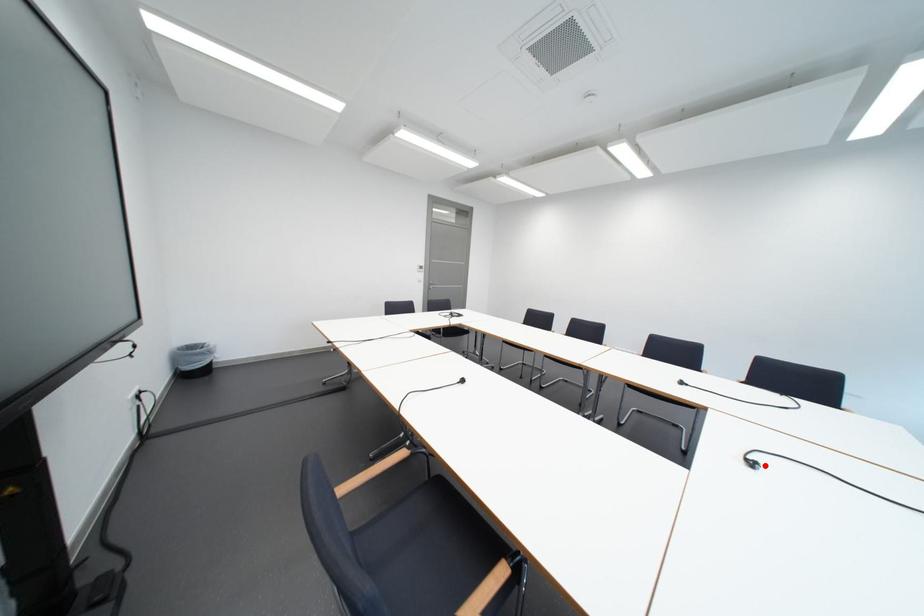
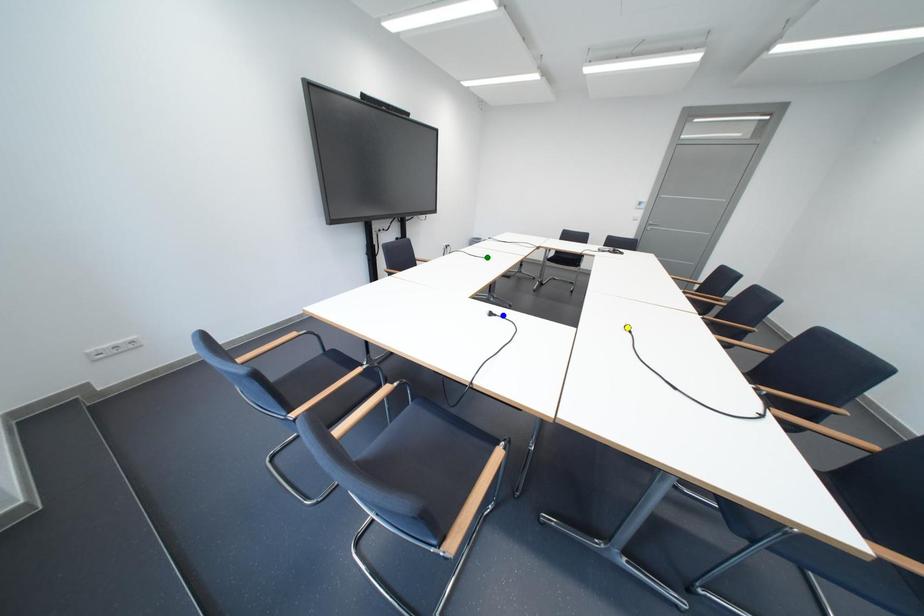
Question: I am providing you with two images of the same scene from different viewpoints. A red point is marked on the first image. You are given multiple points on the second image. Which point in image 2 represents the same 3d spot as the red point in image 1?

Choices:
 (A) blue point
 (B) yellow point
 (C) green point

Answer: (A)